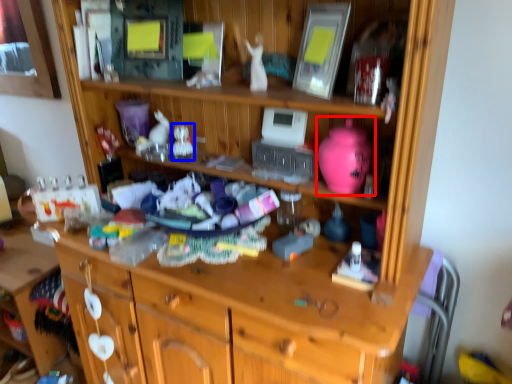
Question: Which point is further to the camera, toy (highlighted by a red box) or toy (highlighted by a blue box)?

Choices:
 (A) toy
 (B) toy

Answer: (B)